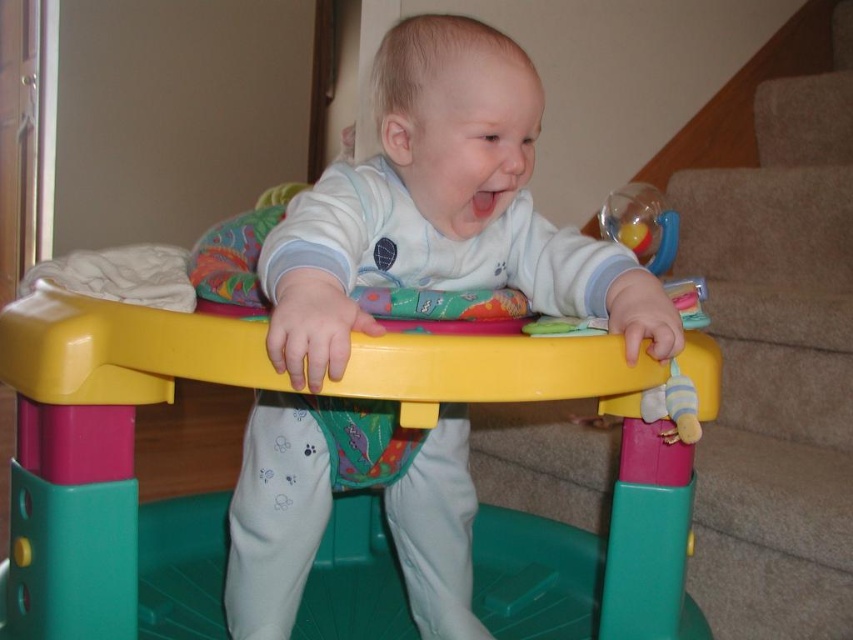
Question: Does white soft baby walker at center appear under carpeted stair at lower right?

Choices:
 (A) no
 (B) yes

Answer: (B)

Question: Which object is farther from the camera taking this photo?

Choices:
 (A) white soft baby walker at center
 (B) carpeted stair at lower right

Answer: (B)

Question: Which of the following is the closest to the observer?

Choices:
 (A) carpeted stair at lower right
 (B) white soft baby walker at center

Answer: (B)

Question: Where is plastic walker at center located in relation to carpeted stair at lower right in the image?

Choices:
 (A) right
 (B) left

Answer: (B)

Question: Which object is farther from the camera taking this photo?

Choices:
 (A) plastic walker at center
 (B) carpeted stair at lower right
 (C) white soft baby walker at center

Answer: (B)

Question: Is white soft baby walker at center positioned at the back of carpeted stair at lower right?

Choices:
 (A) no
 (B) yes

Answer: (A)